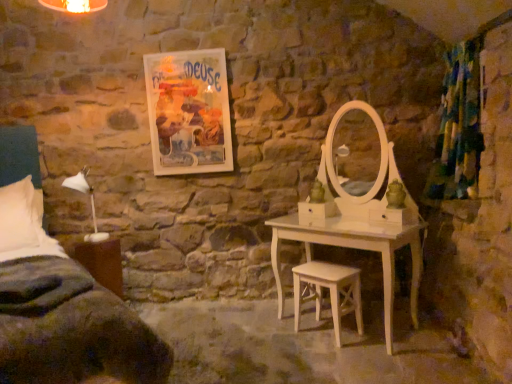
Find the location of a particular element. The width and height of the screenshot is (512, 384). vacant point to the right of white wood stool at center is located at coordinates (368, 334).